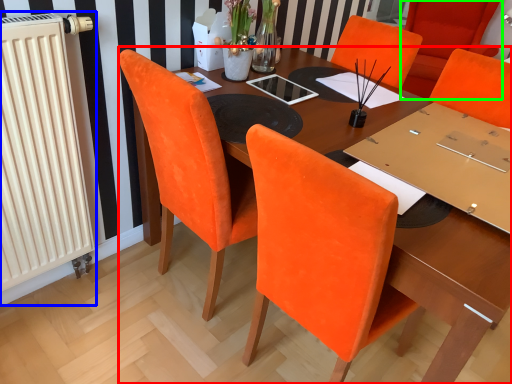
Question: Estimate the real-world distances between objects in this image. Which object is closer to table (highlighted by a red box), radiator (highlighted by a blue box) or chair (highlighted by a green box)?

Choices:
 (A) radiator
 (B) chair

Answer: (A)